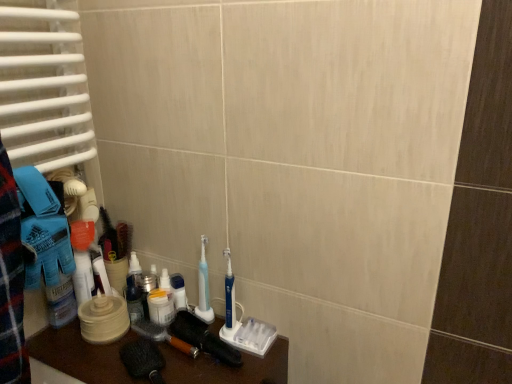
Question: Can you confirm if blue plastic toothbrush at center, which ranks as the second toothbrush in left-to-right order, is shorter than white plastic container at center, which is the 1th toiletry from right to left?

Choices:
 (A) no
 (B) yes

Answer: (A)

Question: Is blue plastic toothbrush at center, acting as the first toothbrush starting from the right, placed right next to white plastic container at center, which is the 1th toiletry from right to left?

Choices:
 (A) no
 (B) yes

Answer: (A)

Question: Considering the relative sizes of blue plastic toothbrush at center, which ranks as the second toothbrush in left-to-right order, and white plastic container at center, which is the 1th toiletry from right to left, in the image provided, is blue plastic toothbrush at center, which ranks as the second toothbrush in left-to-right order, taller than white plastic container at center, which is the 1th toiletry from right to left,?

Choices:
 (A) yes
 (B) no

Answer: (A)

Question: Can you confirm if blue plastic toothbrush at center, which ranks as the second toothbrush in left-to-right order, is smaller than white plastic container at center, which is the 1th toiletry from right to left?

Choices:
 (A) no
 (B) yes

Answer: (A)

Question: From a real-world perspective, is blue plastic toothbrush at center, acting as the first toothbrush starting from the right, physically above white plastic container at center, which is the 1th toiletry from right to left?

Choices:
 (A) no
 (B) yes

Answer: (B)

Question: From the image's perspective, relative to white glossy mouthwash at center, is blue plastic toothbrush at center, the first toothbrush positioned from the left, above or below?

Choices:
 (A) above
 (B) below

Answer: (A)

Question: From a real-world perspective, relative to white glossy mouthwash at center, is blue plastic toothbrush at center, the 2th toothbrush in the right-to-left sequence, vertically above or below?

Choices:
 (A) above
 (B) below

Answer: (A)

Question: Looking at their shapes, would you say blue plastic toothbrush at center, the 2th toothbrush in the right-to-left sequence, is wider or thinner than white glossy mouthwash at center?

Choices:
 (A) wide
 (B) thin

Answer: (B)

Question: Would you say blue plastic toothbrush at center, the first toothbrush positioned from the left, is inside or outside white glossy mouthwash at center?

Choices:
 (A) outside
 (B) inside

Answer: (A)

Question: In terms of size, does translucent plastic container at center, which is the second toiletry in right-to-left order, appear bigger or smaller than blue plastic toothbrush at center, the first toothbrush positioned from the left?

Choices:
 (A) small
 (B) big

Answer: (A)

Question: Considering their positions, is translucent plastic container at center, which is the second toiletry in right-to-left order, located in front of or behind blue plastic toothbrush at center, the first toothbrush positioned from the left?

Choices:
 (A) front
 (B) behind

Answer: (B)

Question: Is translucent plastic container at center, the 1th toiletry when ordered from left to right, to the left or to the right of blue plastic toothbrush at center, the first toothbrush positioned from the left, in the image?

Choices:
 (A) right
 (B) left

Answer: (B)

Question: Is translucent plastic container at center, the 1th toiletry when ordered from left to right, taller or shorter than blue plastic toothbrush at center, the first toothbrush positioned from the left?

Choices:
 (A) short
 (B) tall

Answer: (A)

Question: Is blue plastic toothbrush at center, acting as the first toothbrush starting from the right, spatially inside dark brown wooden brush at lower left, positioned as the 1th brush in left-to-right order, or outside of it?

Choices:
 (A) outside
 (B) inside

Answer: (A)

Question: Considering their positions, is blue plastic toothbrush at center, acting as the first toothbrush starting from the right, located in front of or behind dark brown wooden brush at lower left, positioned as the 1th brush in left-to-right order?

Choices:
 (A) front
 (B) behind

Answer: (A)